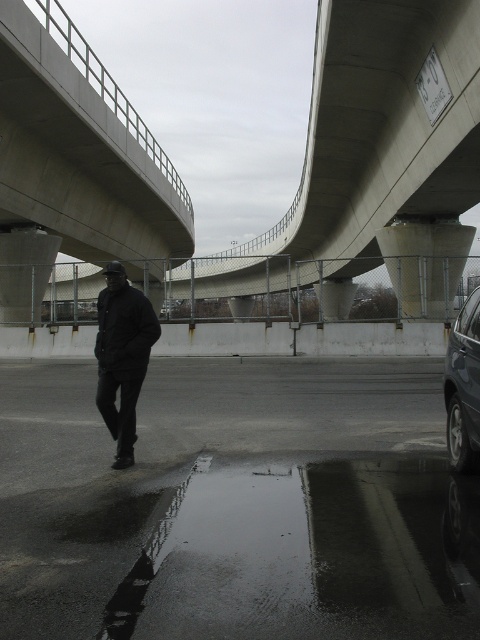
You are a city planner analyzing the image. Based on the scene, which area takes up more space in the image between the glossy asphalt highway at lower left and the concrete at center?

The concrete at center occupies more space than the glossy asphalt highway at lower left.